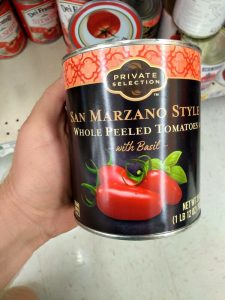
I want to click on tile floor, so click(x=142, y=264).